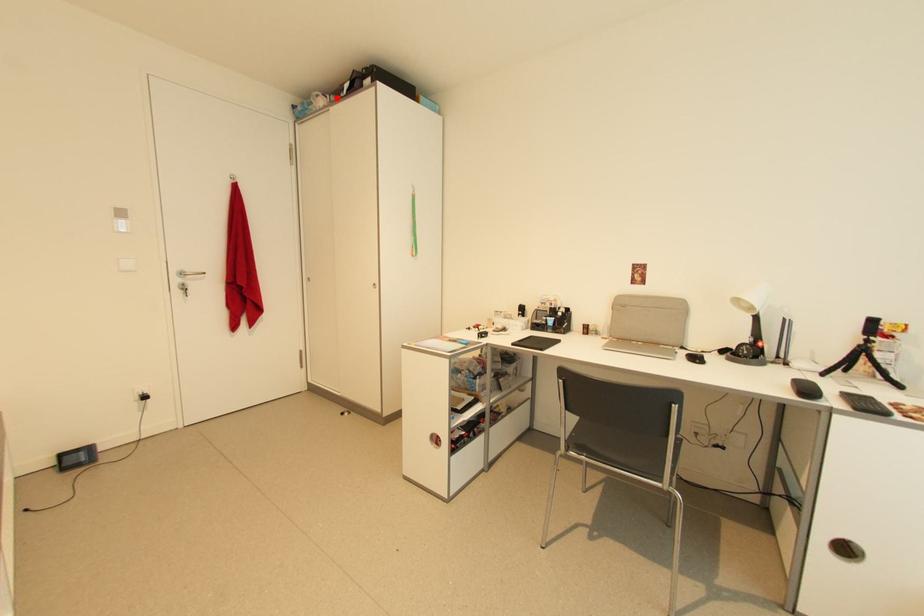
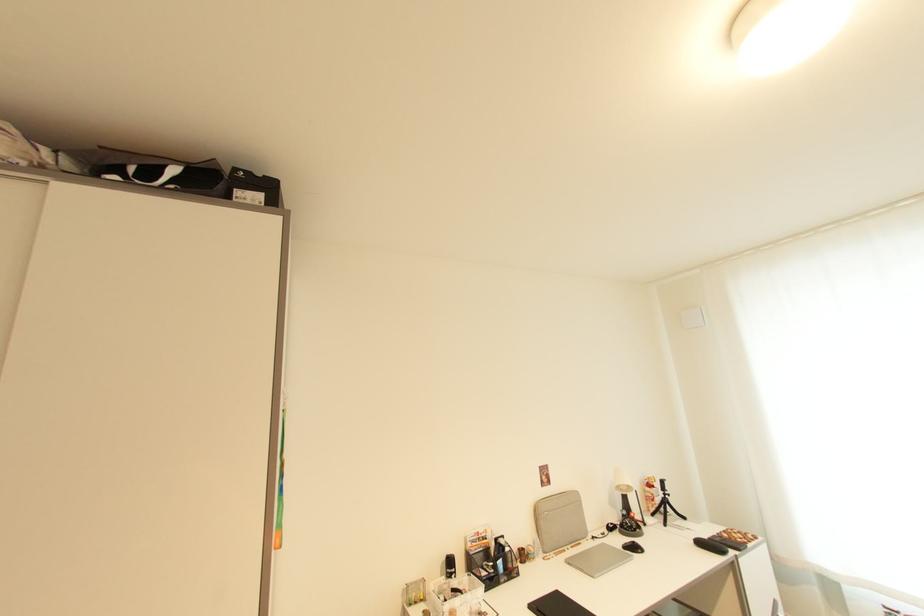
Where in the second image is the point corresponding to the highlighted location from the first image?

(66, 156)